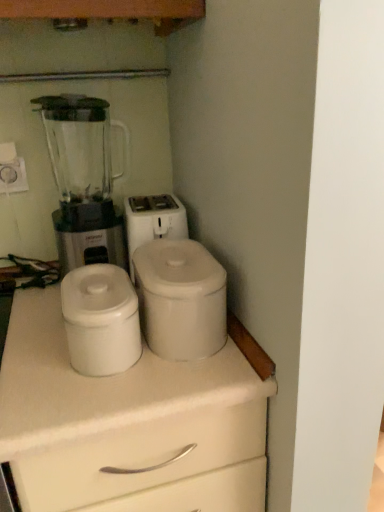
Question: In the image, is white matte chest of drawers at center on the left side or the right side of white matte container at center, which is the second appliance from right to left?

Choices:
 (A) right
 (B) left

Answer: (B)

Question: Relative to white matte container at center, which is the second appliance from right to left, is white matte chest of drawers at center in front or behind?

Choices:
 (A) behind
 (B) front

Answer: (B)

Question: Which is nearer to the transparent plastic blender at left?

Choices:
 (A) white matte chest of drawers at center
 (B) white matte container at center, which is the first appliance from left to right
 (C) white matte canister at center, arranged as the 1th appliance when viewed from the right

Answer: (B)

Question: Which object is the closest to the white matte container at center, which is the first appliance from left to right?

Choices:
 (A) white matte canister at center, arranged as the 1th appliance when viewed from the right
 (B) transparent plastic blender at left
 (C) white matte chest of drawers at center

Answer: (A)